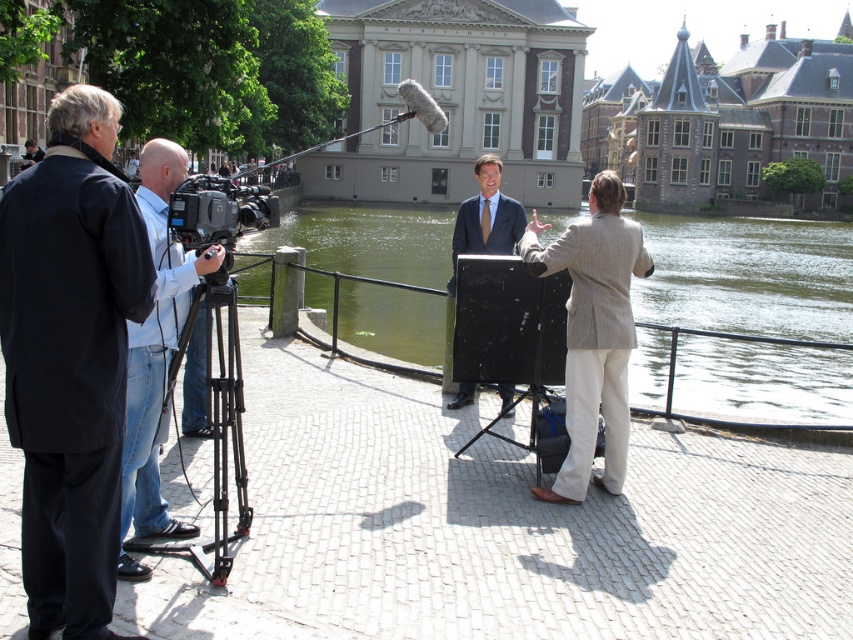
Question: Estimate the real-world distances between objects in this image. Which object is farther from the matte black video camera at left?

Choices:
 (A) denim jeans at left
 (B) green water at center

Answer: (B)

Question: In this image, where is stone gray building at upper center located relative to matte black video camera at left?

Choices:
 (A) above
 (B) below

Answer: (A)

Question: Can you confirm if green water at center is bigger than matte black video camera at left?

Choices:
 (A) yes
 (B) no

Answer: (A)

Question: Among these objects, which one is farthest from the camera?

Choices:
 (A) denim jeans at left
 (B) green water at center
 (C) matte black video camera at left
 (D) stone gray building at upper center

Answer: (D)

Question: Does denim jeans at left lie behind matte black suit at center?

Choices:
 (A) no
 (B) yes

Answer: (A)

Question: Among these points, which one is farthest from the camera?

Choices:
 (A) (720, 196)
 (B) (189, 243)
 (C) (445, 220)
 (D) (82, 320)

Answer: (A)